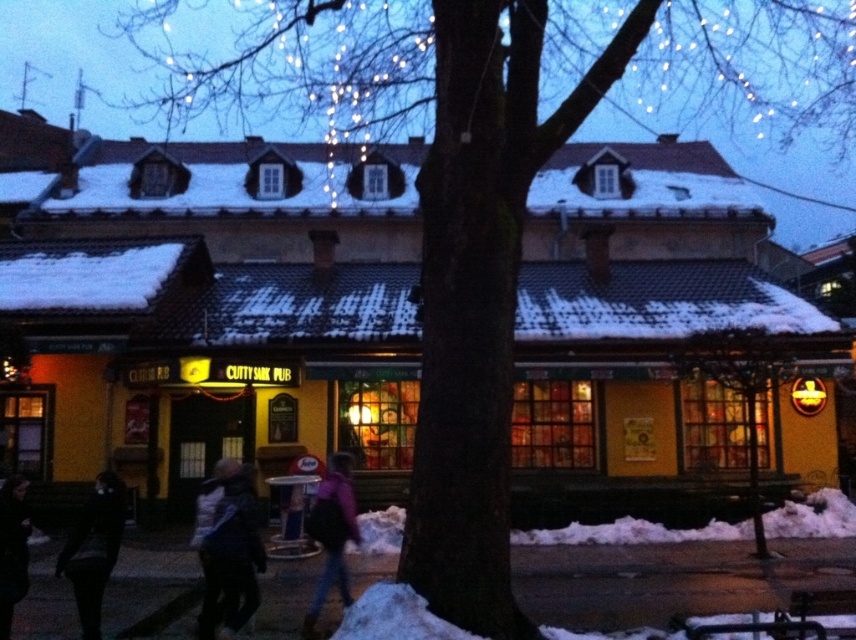
Which is above, white fuzzy coat at lower left or black leather jacket at lower left?

Positioned higher is black leather jacket at lower left.

Is white fuzzy coat at lower left to the left of black leather jacket at lower left from the viewer's perspective?

No, white fuzzy coat at lower left is not to the left of black leather jacket at lower left.

Where is `white fuzzy coat at lower left`? This screenshot has width=856, height=640. white fuzzy coat at lower left is located at coordinates (230, 554).

Find the location of a particular element. Image resolution: width=856 pixels, height=640 pixels. white fuzzy coat at lower left is located at coordinates (230, 554).

Which of these two, white fuzzy coat at lower left or dark gray jacket at lower left, stands taller?

With more height is white fuzzy coat at lower left.

Is white fuzzy coat at lower left smaller than dark gray jacket at lower left?

No.

Is point (250, 577) positioned after point (76, 515)?

No, (250, 577) is in front of (76, 515).

Where is `white fuzzy coat at lower left`? This screenshot has height=640, width=856. white fuzzy coat at lower left is located at coordinates (230, 554).

Can you confirm if dark gray jacket at lower left is bigger than purple fabric jacket at center?

No.

Which is in front, point (103, 557) or point (349, 528)?

Point (103, 557) is in front.

Locate an element on the screen. This screenshot has height=640, width=856. dark gray jacket at lower left is located at coordinates (93, 548).